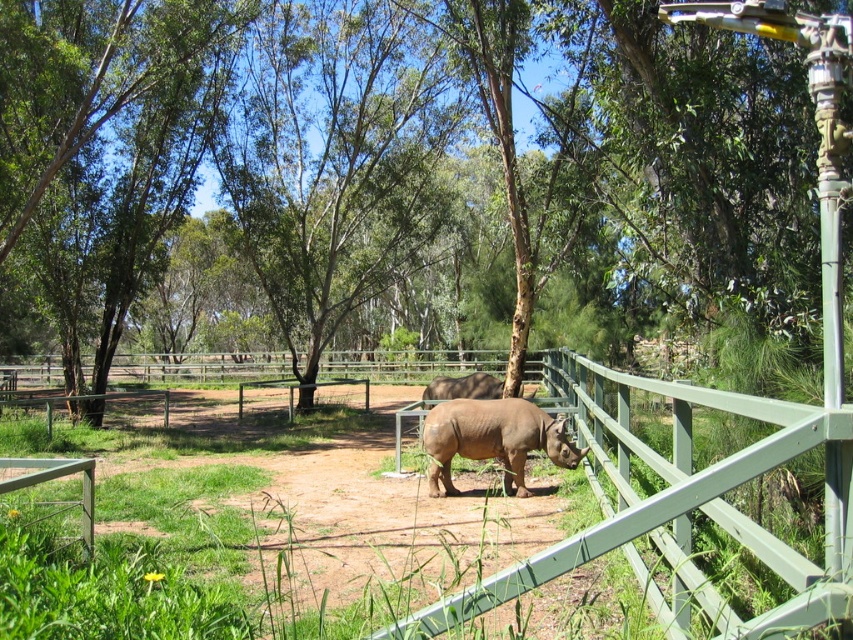
Question: Among these objects, which one is farthest from the camera?

Choices:
 (A) brown matte rhinoceros at center
 (B) brown textured tree at center

Answer: (A)

Question: Is brown textured tree at center below brown matte rhinoceros at center?

Choices:
 (A) yes
 (B) no

Answer: (B)

Question: Can you confirm if brown textured tree at center is bigger than brown matte rhinoceros at center?

Choices:
 (A) yes
 (B) no

Answer: (A)

Question: Which point appears farthest from the camera in this image?

Choices:
 (A) (320, 83)
 (B) (432, 444)

Answer: (A)

Question: Is brown textured tree at center positioned at the back of brown matte rhinoceros at center?

Choices:
 (A) yes
 (B) no

Answer: (B)